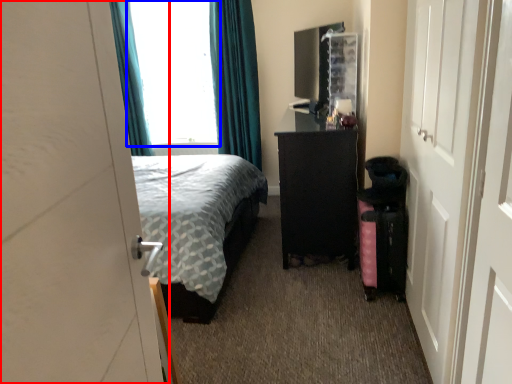
Question: Which point is further to the camera, door (highlighted by a red box) or window (highlighted by a blue box)?

Choices:
 (A) door
 (B) window

Answer: (B)